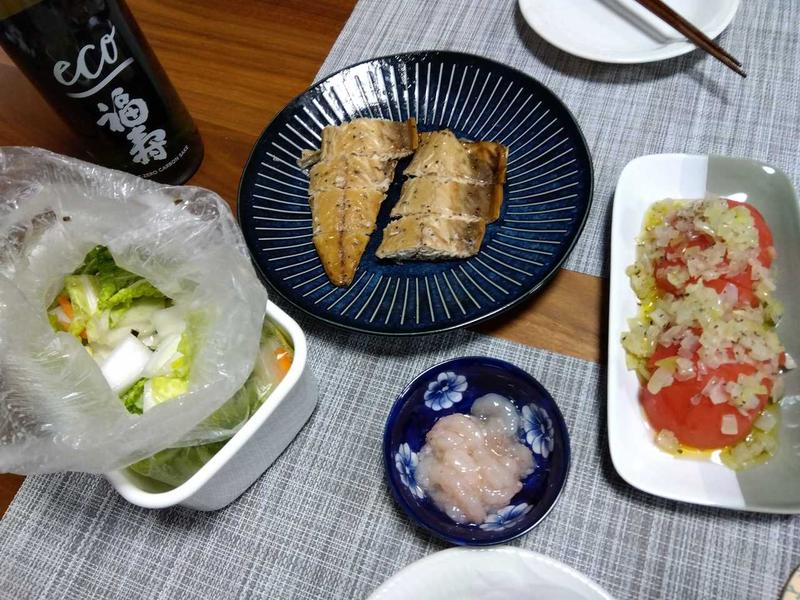
Find the location of a particular element. table is located at coordinates (244, 78).